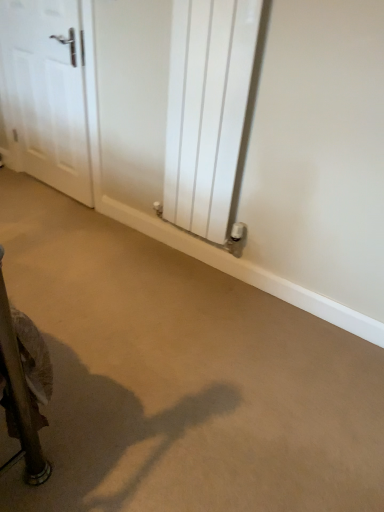
Question: Is beige carpet at center aimed at white glossy door at upper left?

Choices:
 (A) no
 (B) yes

Answer: (A)

Question: Is beige carpet at center closer to camera compared to white glossy door at upper left?

Choices:
 (A) yes
 (B) no

Answer: (A)

Question: Is beige carpet at center next to white glossy door at upper left?

Choices:
 (A) yes
 (B) no

Answer: (B)

Question: Considering the relative sizes of beige carpet at center and white glossy door at upper left in the image provided, is beige carpet at center wider than white glossy door at upper left?

Choices:
 (A) no
 (B) yes

Answer: (B)

Question: Is white glossy door at upper left located within beige carpet at center?

Choices:
 (A) no
 (B) yes

Answer: (A)

Question: From a real-world perspective, is white metallic radiator at center physically located above or below white glossy door at upper left?

Choices:
 (A) above
 (B) below

Answer: (A)

Question: From the image's perspective, is white metallic radiator at center located above or below white glossy door at upper left?

Choices:
 (A) above
 (B) below

Answer: (B)

Question: Would you say white metallic radiator at center is to the left or to the right of white glossy door at upper left in the picture?

Choices:
 (A) right
 (B) left

Answer: (A)

Question: Considering the positions of white metallic radiator at center and white glossy door at upper left in the image, is white metallic radiator at center bigger or smaller than white glossy door at upper left?

Choices:
 (A) big
 (B) small

Answer: (A)

Question: Is point (64, 134) positioned closer to the camera than point (201, 180)?

Choices:
 (A) farther
 (B) closer

Answer: (A)

Question: Is white glossy door at upper left in front of or behind white metallic radiator at center in the image?

Choices:
 (A) behind
 (B) front

Answer: (A)

Question: Is white glossy door at upper left wider or thinner than white metallic radiator at center?

Choices:
 (A) thin
 (B) wide

Answer: (A)

Question: In terms of height, does white glossy door at upper left look taller or shorter compared to white metallic radiator at center?

Choices:
 (A) short
 (B) tall

Answer: (A)

Question: Considering the relative positions of white metallic radiator at center and beige carpet at center in the image provided, is white metallic radiator at center to the left or to the right of beige carpet at center?

Choices:
 (A) left
 (B) right

Answer: (B)

Question: From the image's perspective, is white metallic radiator at center located above or below beige carpet at center?

Choices:
 (A) below
 (B) above

Answer: (B)